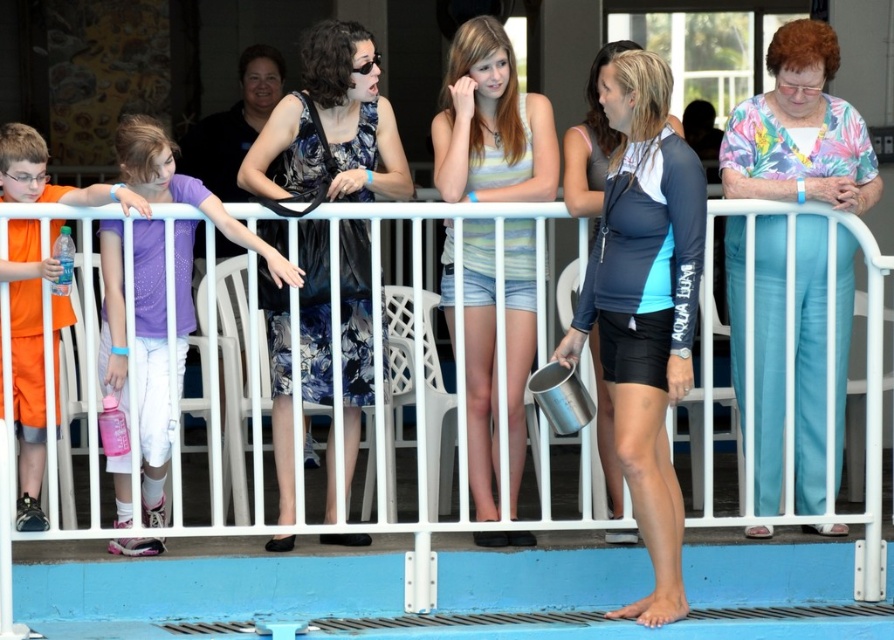
Question: Which point is closer to the camera?

Choices:
 (A) white metal fence at center
 (B) floral fabric blouse at right
 (C) purple matte shirt at left

Answer: (A)

Question: Is white metal fence at center to the right of pink fabric pants at left from the viewer's perspective?

Choices:
 (A) yes
 (B) no

Answer: (A)

Question: Is white metal fence at center wider than floral fabric blouse at right?

Choices:
 (A) yes
 (B) no

Answer: (B)

Question: Which point is farther to the camera?

Choices:
 (A) white metal fence at center
 (B) floral dress at center
 (C) floral fabric blouse at right
 (D) pink fabric pants at left

Answer: (C)

Question: Which of these objects is positioned closest to the white metal fence at center?

Choices:
 (A) striped tank top at center
 (B) purple matte shirt at left

Answer: (B)

Question: Can you confirm if floral fabric blouse at right is bigger than pink fabric pants at left?

Choices:
 (A) yes
 (B) no

Answer: (A)